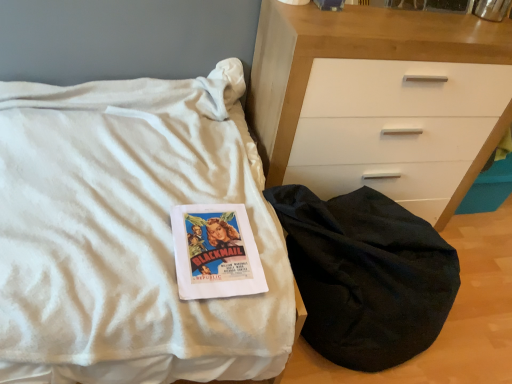
Question: Would you say white matte chest of drawers at center is to the left or to the right of black fabric sleeping bag at lower right in the picture?

Choices:
 (A) left
 (B) right

Answer: (B)

Question: Is white matte chest of drawers at center inside the boundaries of black fabric sleeping bag at lower right, or outside?

Choices:
 (A) inside
 (B) outside

Answer: (B)

Question: Which is nearer to the black fabric sleeping bag at lower right?

Choices:
 (A) white matte chest of drawers at center
 (B) white soft blanket at center

Answer: (A)

Question: Which object is the farthest from the black fabric sleeping bag at lower right?

Choices:
 (A) white soft blanket at center
 (B) white matte chest of drawers at center

Answer: (A)